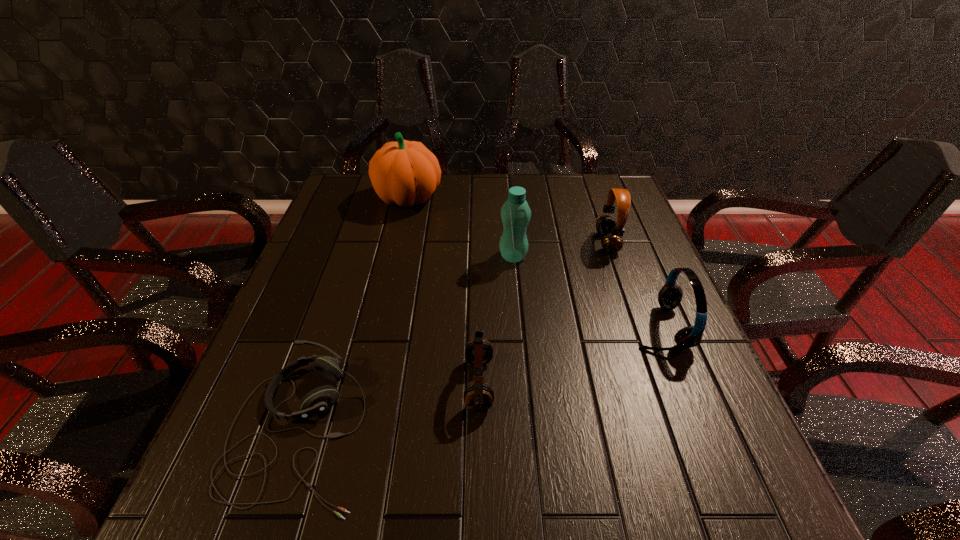
I want to click on the farthest object, so click(x=404, y=173).

Where is `the fourth object from left to right`? The image size is (960, 540). the fourth object from left to right is located at coordinates (515, 213).

The height and width of the screenshot is (540, 960). Find the location of `the farthest headset`. the farthest headset is located at coordinates (612, 242).

The height and width of the screenshot is (540, 960). Identify the location of the third headset from right to left. (478, 397).

You are a GUI agent. You are given a task and a screenshot of the screen. Output one action in this format:
    pyautogui.click(x=<x>, y=<y>)
    Task: Click on the third tallest headset
    
    Given the screenshot: What is the action you would take?
    pyautogui.click(x=478, y=397)

This screenshot has width=960, height=540. I want to click on the shortest object, so click(319, 400).

I want to click on the leftmost headset, so click(x=319, y=400).

At what (x,y) coordinates should I click in order to perform the action: click on free region located on the front of the farthest object. Please return your answer as a coordinate pair (x, y). The height and width of the screenshot is (540, 960). Looking at the image, I should click on (390, 279).

Locate an element on the screen. blank space located on the front of the third object from right to left is located at coordinates (524, 379).

Find the location of a particular element. This screenshot has height=540, width=960. vacant space located 0.340m on the ear cups of the farthest headset is located at coordinates (473, 242).